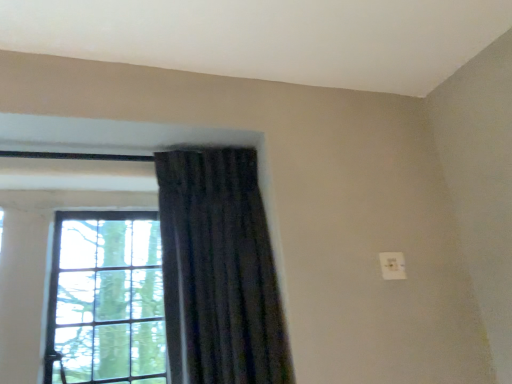
Question: Is dark fabric curtain at center oriented towards clear glass window at left?

Choices:
 (A) yes
 (B) no

Answer: (B)

Question: Can you confirm if dark fabric curtain at center is smaller than clear glass window at left?

Choices:
 (A) no
 (B) yes

Answer: (A)

Question: From a real-world perspective, is dark fabric curtain at center positioned over clear glass window at left based on gravity?

Choices:
 (A) no
 (B) yes

Answer: (A)

Question: From the image's perspective, is dark fabric curtain at center on top of clear glass window at left?

Choices:
 (A) no
 (B) yes

Answer: (B)

Question: Would you say dark fabric curtain at center contains clear glass window at left?

Choices:
 (A) yes
 (B) no

Answer: (B)

Question: From the image's perspective, is dark fabric curtain at center beneath clear glass window at left?

Choices:
 (A) no
 (B) yes

Answer: (A)

Question: From a real-world perspective, is clear glass window at left beneath dark fabric curtain at center?

Choices:
 (A) no
 (B) yes

Answer: (A)

Question: Is clear glass window at left facing away from dark fabric curtain at center?

Choices:
 (A) yes
 (B) no

Answer: (B)

Question: Is dark fabric curtain at center completely or partially inside clear glass window at left?

Choices:
 (A) yes
 (B) no

Answer: (B)

Question: Are clear glass window at left and dark fabric curtain at center beside each other?

Choices:
 (A) no
 (B) yes

Answer: (A)

Question: Considering the relative sizes of clear glass window at left and dark fabric curtain at center in the image provided, is clear glass window at left shorter than dark fabric curtain at center?

Choices:
 (A) no
 (B) yes

Answer: (B)

Question: Is the depth of clear glass window at left greater than that of dark fabric curtain at center?

Choices:
 (A) yes
 (B) no

Answer: (A)

Question: Visually, is dark fabric curtain at center positioned to the left or to the right of clear glass window at left?

Choices:
 (A) right
 (B) left

Answer: (A)